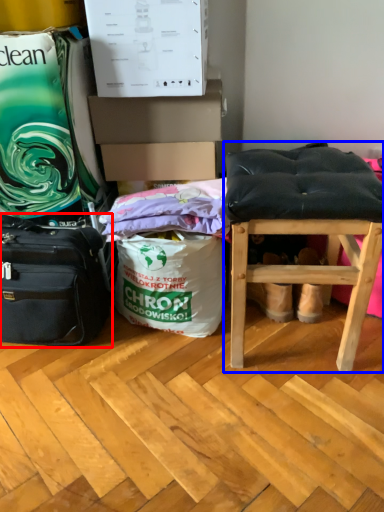
Question: Among these objects, which one is nearest to the camera, luggage and bags (highlighted by a red box) or stool (highlighted by a blue box)?

Choices:
 (A) luggage and bags
 (B) stool

Answer: (B)